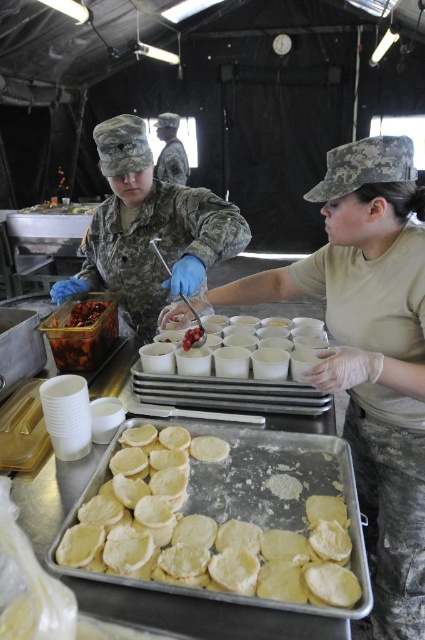
Question: Which point is closer to the camera?

Choices:
 (A) (70, 346)
 (B) (139, 420)
 (C) (104, 237)

Answer: (B)

Question: Which point is farther to the camera?

Choices:
 (A) white matte cups at center
 (B) camouflage fabric uniform at center

Answer: (B)

Question: Is camouflage fabric uniform at center to the left of shiny plastic container at center left from the viewer's perspective?

Choices:
 (A) no
 (B) yes

Answer: (A)

Question: Considering the relative positions of white matte cups at center and shiny plastic container at center left in the image provided, where is white matte cups at center located with respect to shiny plastic container at center left?

Choices:
 (A) right
 (B) left

Answer: (A)

Question: Which object appears farthest from the camera in this image?

Choices:
 (A) camouflage fabric uniform at center
 (B) white matte cups at center
 (C) shiny plastic container at center left
 (D) yellow doughy circles at center

Answer: (C)

Question: Can you confirm if white matte cups at center is positioned above shiny plastic container at center left?

Choices:
 (A) yes
 (B) no

Answer: (B)